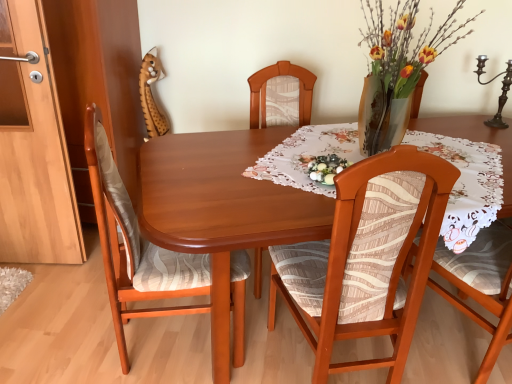
Image resolution: width=512 pixels, height=384 pixels. Identify the location of vacant space situated on the left part of wooden chair at left, arranged as the first chair when viewed from the left. (74, 334).